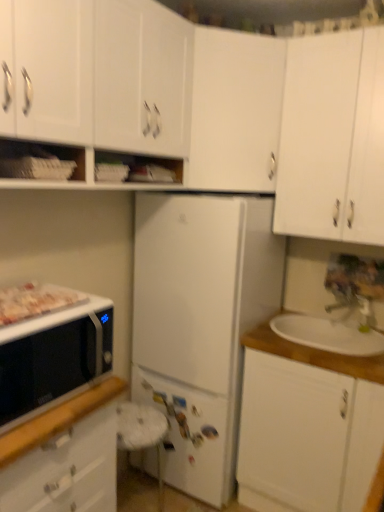
Question: From a real-world perspective, is white matte cabinet at upper left, arranged as the second cabinetry when viewed from the left, under white matte cabinet at upper center, marked as the third cabinetry in a right-to-left arrangement?

Choices:
 (A) yes
 (B) no

Answer: (B)

Question: Is white matte cabinet at upper left, arranged as the second cabinetry when viewed from the left, closer to the viewer compared to white matte cabinet at upper center, which is the 3th cabinetry in left-to-right order?

Choices:
 (A) yes
 (B) no

Answer: (A)

Question: Could you tell me if white matte cabinet at upper left, which is the 4th cabinetry from right to left, is facing white matte cabinet at upper center, which is the 3th cabinetry in left-to-right order?

Choices:
 (A) no
 (B) yes

Answer: (A)

Question: Is white matte cabinet at upper left, arranged as the second cabinetry when viewed from the left, taller than white matte cabinet at upper center, which is the 3th cabinetry in left-to-right order?

Choices:
 (A) no
 (B) yes

Answer: (B)

Question: Is white matte cabinet at upper left, which is the 4th cabinetry from right to left, positioned with its back to white matte cabinet at upper center, which is the 3th cabinetry in left-to-right order?

Choices:
 (A) no
 (B) yes

Answer: (A)

Question: Is white matte cabinet at upper left, which is the 4th cabinetry from right to left, bigger than white matte cabinet at upper center, marked as the third cabinetry in a right-to-left arrangement?

Choices:
 (A) yes
 (B) no

Answer: (A)

Question: From a real-world perspective, is white wood sink at right on white wood cabinet at right, the 2th cabinetry when ordered from right to left?

Choices:
 (A) no
 (B) yes

Answer: (B)

Question: Is white wood sink at right bigger than white wood cabinet at right, placed as the fourth cabinetry when sorted from left to right?

Choices:
 (A) no
 (B) yes

Answer: (A)

Question: Is white wood sink at right shorter than white wood cabinet at right, the 2th cabinetry when ordered from right to left?

Choices:
 (A) yes
 (B) no

Answer: (A)

Question: Is white wood sink at right wider than white wood cabinet at right, the 2th cabinetry when ordered from right to left?

Choices:
 (A) yes
 (B) no

Answer: (B)

Question: Is white wood sink at right not inside white wood cabinet at right, the 2th cabinetry when ordered from right to left?

Choices:
 (A) no
 (B) yes

Answer: (A)

Question: Is white wood sink at right at the left side of white wood cabinet at right, the 2th cabinetry when ordered from right to left?

Choices:
 (A) yes
 (B) no

Answer: (B)

Question: From a real-world perspective, is metallic silver faucet at upper right on white matte microwave at lower left, the 5th cabinetry when ordered from right to left?

Choices:
 (A) no
 (B) yes

Answer: (B)